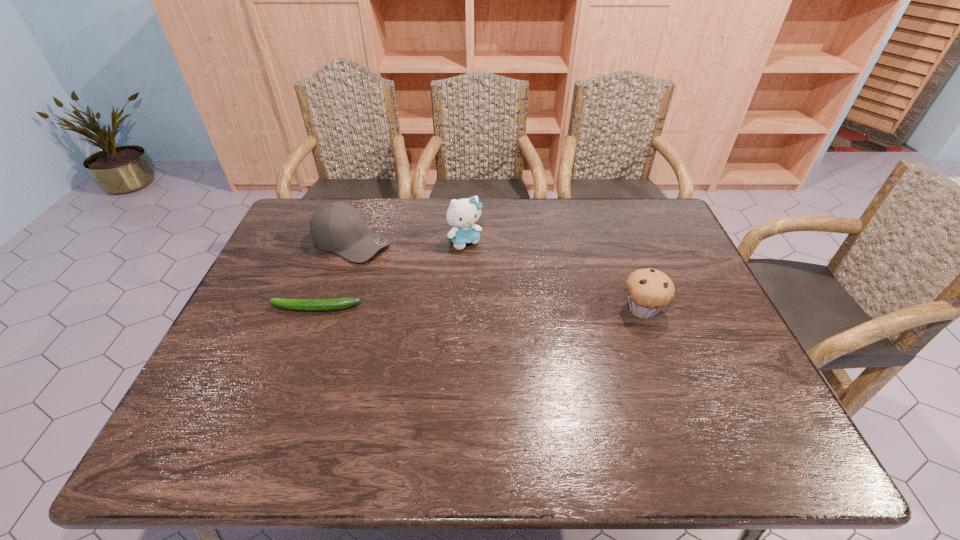
At what (x,y) coordinates should I click in order to perform the action: click on the shortest object. Please return your answer as a coordinate pair (x, y). This screenshot has height=540, width=960. Looking at the image, I should click on (337, 303).

This screenshot has width=960, height=540. I want to click on the rightmost object, so click(x=649, y=290).

The image size is (960, 540). I want to click on kitten, so click(x=461, y=214).

This screenshot has height=540, width=960. What are the coordinates of `the third object from left to right` in the screenshot? It's located at (461, 214).

The width and height of the screenshot is (960, 540). Find the location of `baseball cap`. baseball cap is located at coordinates (338, 227).

This screenshot has width=960, height=540. In order to click on free space located 0.080m on the front-facing side of the zucchini in this screenshot , I will do `click(241, 308)`.

Locate an element on the screen. vacant space situated 0.100m on the right of the muffin is located at coordinates (702, 309).

This screenshot has width=960, height=540. Identify the location of free space located on the face of the kitten. (544, 341).

Identify the location of vacant area located on the face of the kitten. The height and width of the screenshot is (540, 960). (496, 281).

I want to click on free spot located 0.250m on the face of the kitten, so click(515, 303).